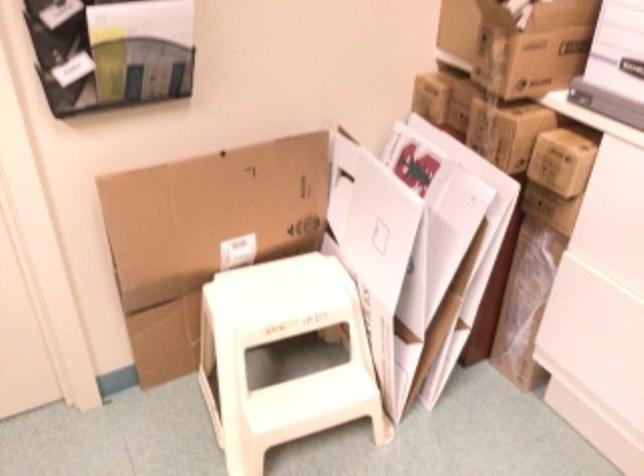
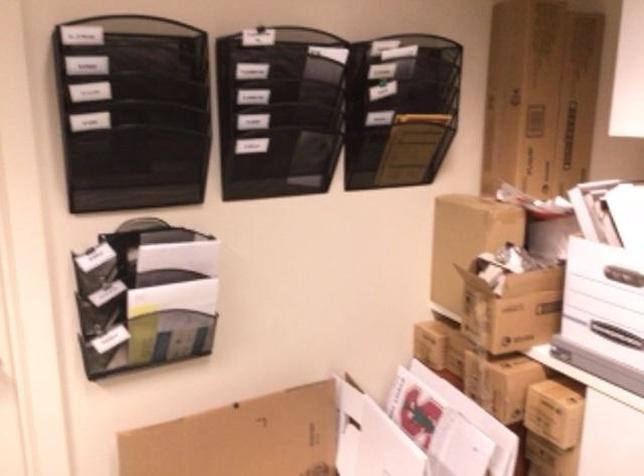
Question: What movement of the cameraman would produce the second image?

Choices:
 (A) Left
 (B) Right
 (C) Forward
 (D) Backward

Answer: (D)